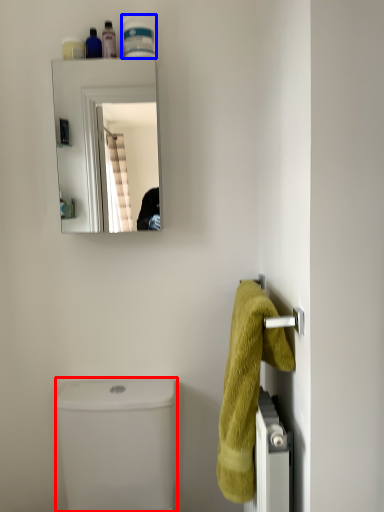
Question: Which point is closer to the camera, toilet bowl (highlighted by a red box) or toiletry (highlighted by a blue box)?

Choices:
 (A) toilet bowl
 (B) toiletry

Answer: (A)